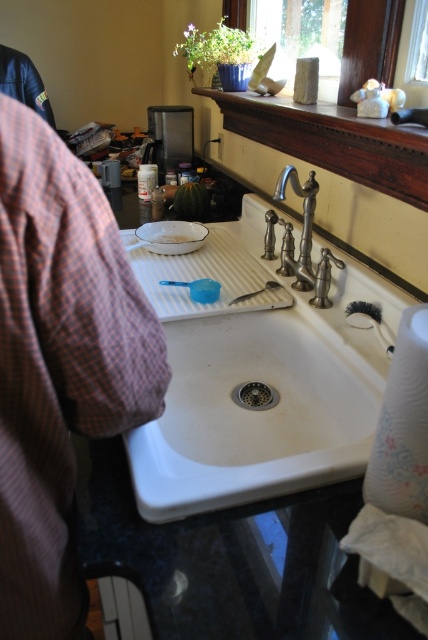
You are trying to clean the polished chrome faucet at center and the white matte plate at center. Which object should you reach for first if you want to start with the one closer to you?

The polished chrome faucet at center is closer to the viewer than the white matte plate at center, so you should reach for the polished chrome faucet at center first.

You are trying to determine which object is taller between the white ceramic sink at center and the white matte plate at center. Based on the scene description, which one is taller?

The white ceramic sink at center is taller than the white matte plate at center according to the description.

Based on the photo, you are trying to clean the white matte plate at center in the kitchen sink. The polished chrome faucet at center is where you need to adjust to control the water flow. Which direction should you move your hand to reach the faucet from the plate?

To reach the polished chrome faucet at center from the white matte plate at center, you should move your hand to the right since the faucet is positioned to the right of the plate.